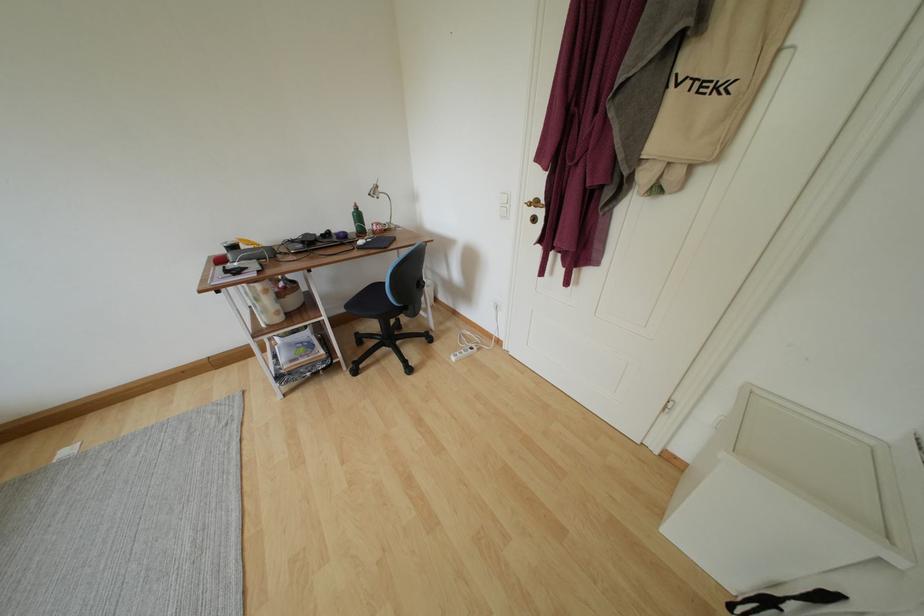
The image size is (924, 616). Find the location of `green water bottle`. green water bottle is located at coordinates (359, 221).